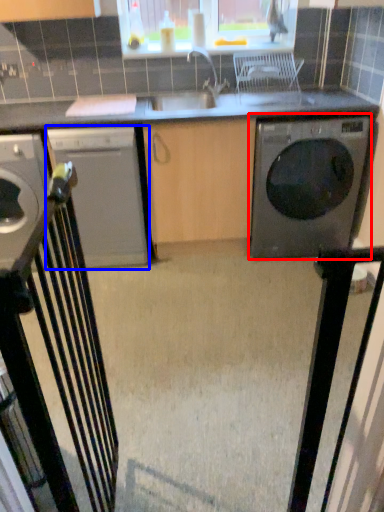
Question: Among these objects, which one is farthest to the camera, washing machine (highlighted by a red box) or home appliance (highlighted by a blue box)?

Choices:
 (A) washing machine
 (B) home appliance

Answer: (B)